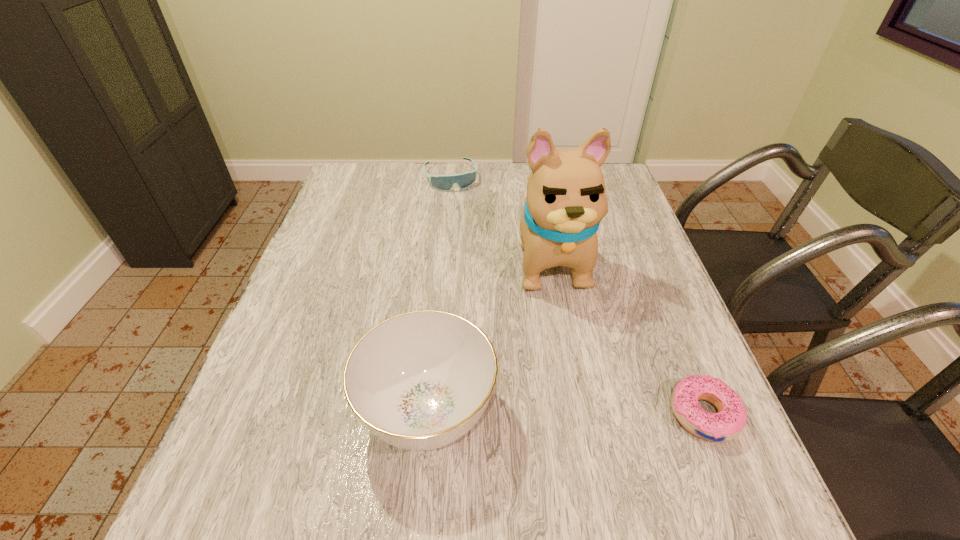
Where is `free space between the goggles and the doughnut`? This screenshot has width=960, height=540. free space between the goggles and the doughnut is located at coordinates (577, 296).

Locate an element on the screen. The image size is (960, 540). vacant space that is in between the farthest object and the shortest object is located at coordinates (577, 296).

Identify the location of vacant space that is in between the farthest object and the puppy. (501, 218).

The height and width of the screenshot is (540, 960). In order to click on free space between the third shortest object and the doughnut in this screenshot , I will do `click(565, 413)`.

Image resolution: width=960 pixels, height=540 pixels. I want to click on free area in between the third nearest object and the third shortest object, so click(x=490, y=335).

The height and width of the screenshot is (540, 960). In order to click on object that is the second closest to the chinaware in this screenshot , I will do `click(727, 424)`.

You are a GUI agent. You are given a task and a screenshot of the screen. Output one action in this format:
    pyautogui.click(x=<x>, y=<y>)
    Task: Click on the third closest object relative to the second object from right to left
    This screenshot has width=960, height=540.
    Given the screenshot: What is the action you would take?
    pyautogui.click(x=727, y=424)

The height and width of the screenshot is (540, 960). I want to click on free location that satisfies the following two spatial constraints: 1. on the back side of the third nearest object; 2. on the left side of the third shortest object, so click(x=443, y=259).

Locate an element on the screen. The width and height of the screenshot is (960, 540). free region that satisfies the following two spatial constraints: 1. on the back side of the chinaware; 2. on the right side of the puppy is located at coordinates (443, 259).